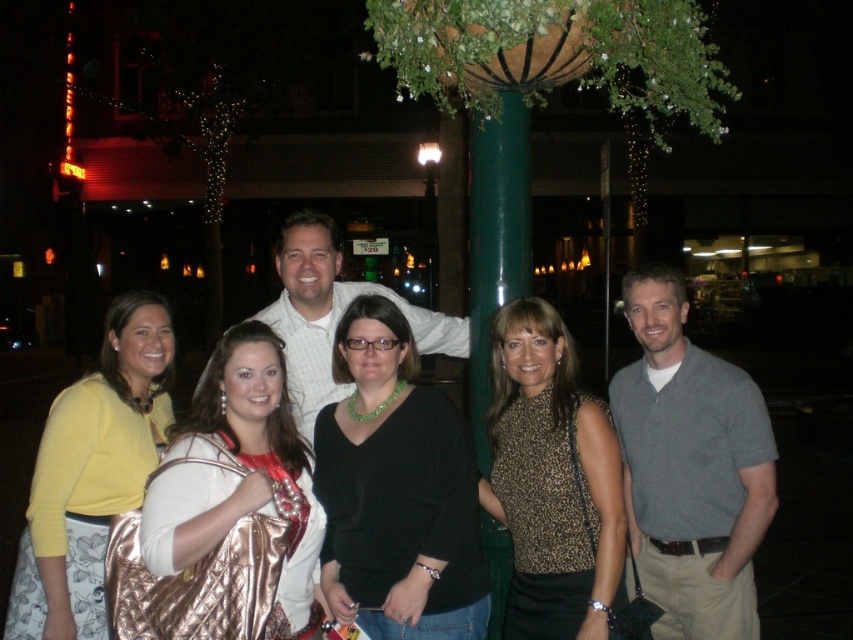
Image resolution: width=853 pixels, height=640 pixels. Describe the element at coordinates (552, 481) in the screenshot. I see `leopard print top at center` at that location.

Locate an element on the screen. leopard print top at center is located at coordinates (552, 481).

Does black matte sweater at center come behind leopard print top at center?

Yes, black matte sweater at center is behind leopard print top at center.

Is point (433, 604) positioned behind point (556, 435)?

No, it is in front of (556, 435).

Which is behind, point (438, 529) or point (538, 490)?

Point (538, 490)

Where is `black matte sweater at center`? black matte sweater at center is located at coordinates (396, 490).

Which is below, yellow sweater at center or metallic gold purse at center?

Positioned lower is yellow sweater at center.

Can you confirm if yellow sweater at center is smaller than metallic gold purse at center?

Incorrect, yellow sweater at center is not smaller in size than metallic gold purse at center.

Which is behind, point (163, 420) or point (288, 604)?

Positioned behind is point (163, 420).

Where is `yellow sweater at center`? yellow sweater at center is located at coordinates [x=91, y=474].